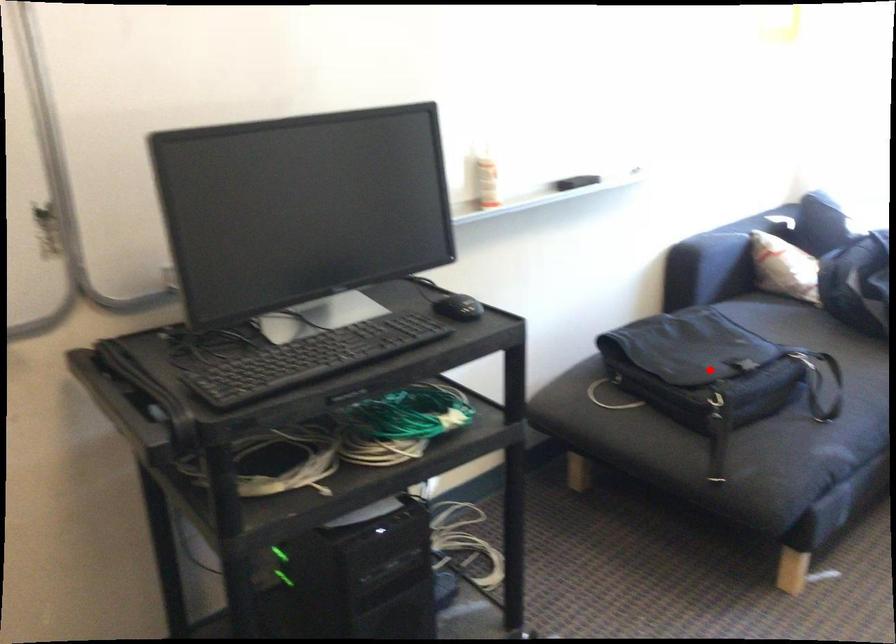
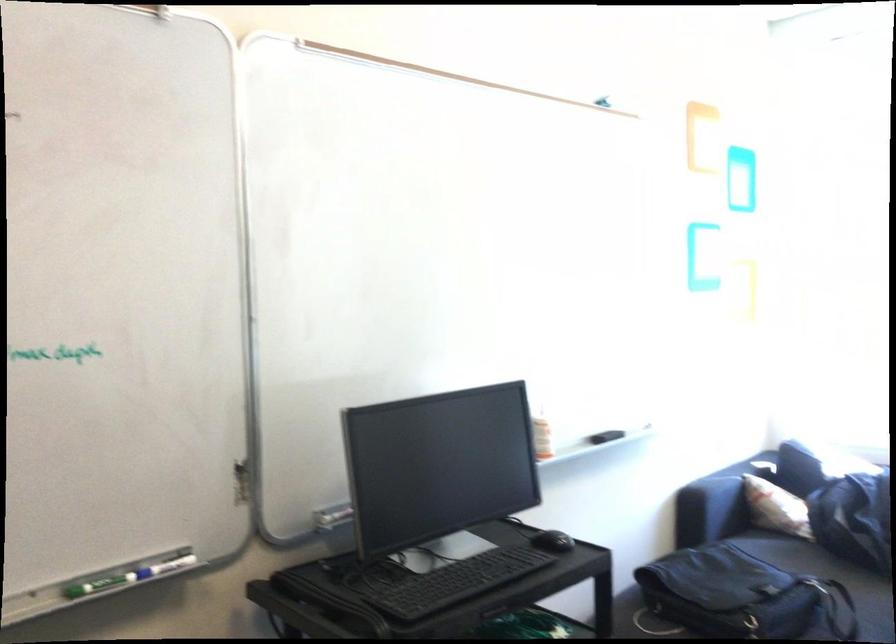
Question: I am providing you with two images of the same scene from different viewpoints. A red point is shown in image1. For the corresponding object point in image2, is it positioned nearer or farther from the camera?

Choices:
 (A) Nearer
 (B) Farther

Answer: (B)